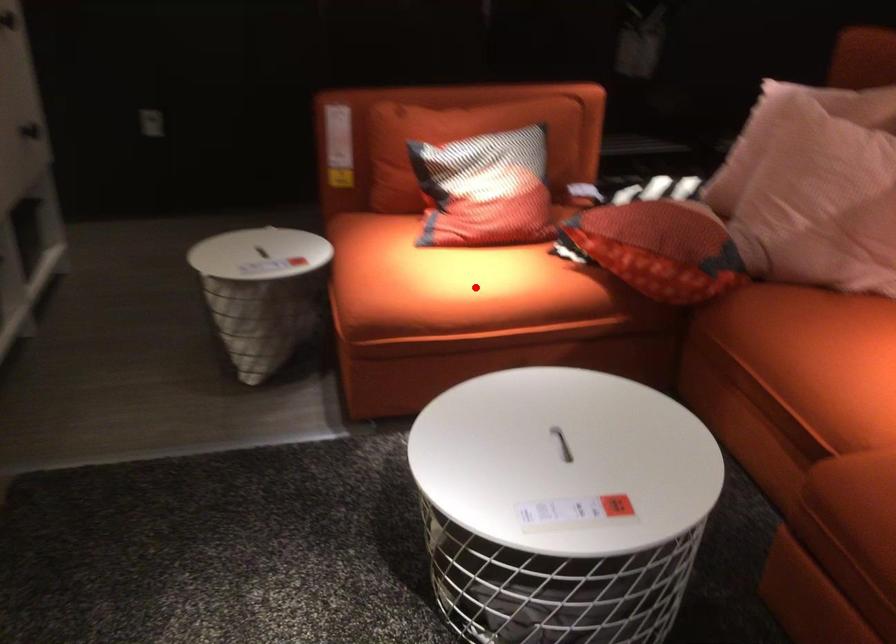
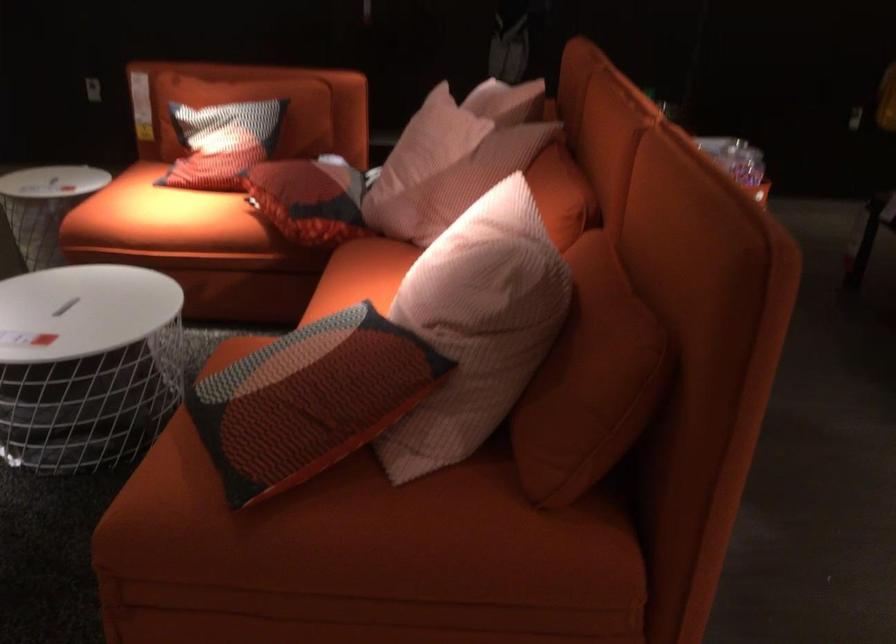
Question: A red point is marked in image1. In image2, is the corresponding 3D point closer to the camera or farther? Reply with the corresponding letter.

Choices:
 (A) The corresponding 3D point is closer.
 (B) The corresponding 3D point is farther.

Answer: (B)